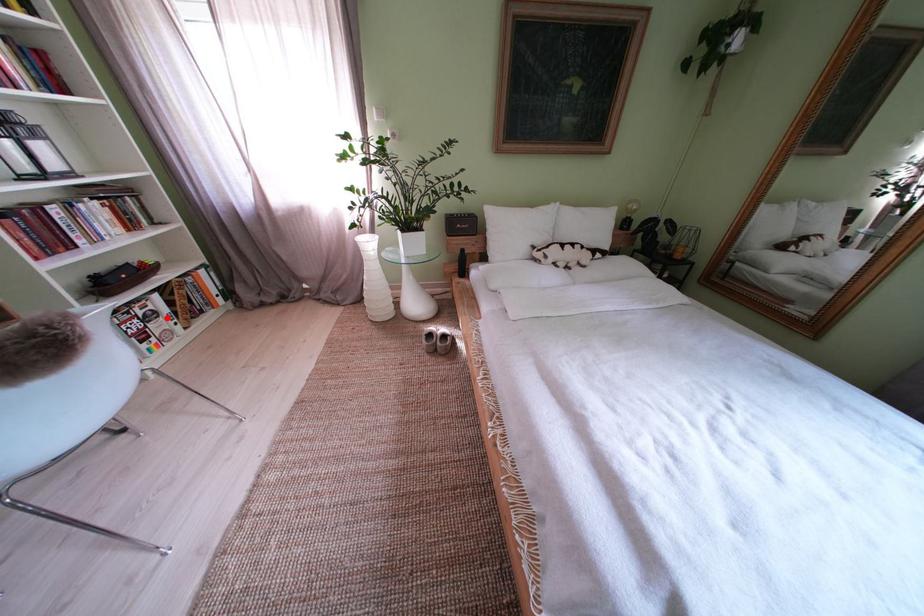
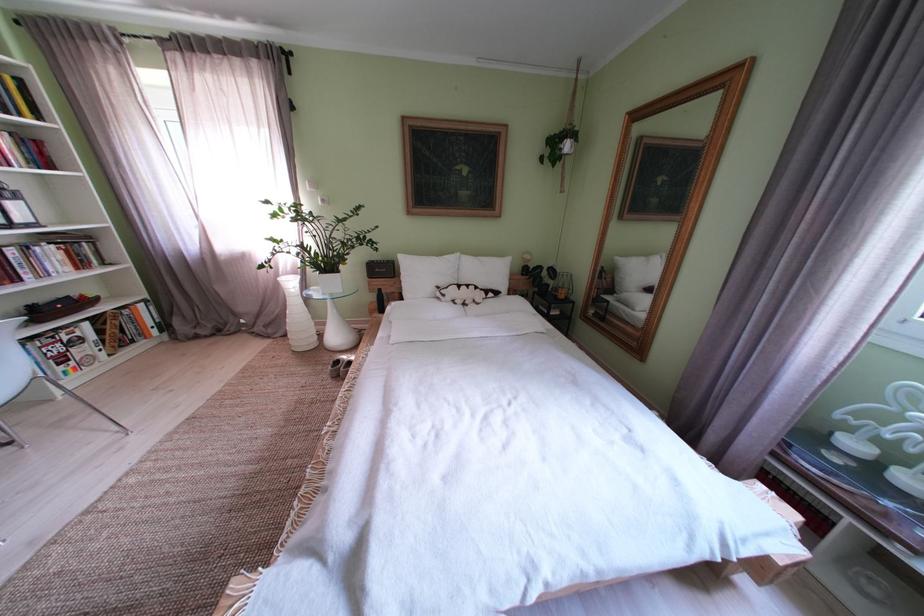
Question: A red point is marked in image1. In image2, is the corresponding 3D point closer to the camera or farther? Reply with the corresponding letter.

Choices:
 (A) The corresponding 3D point is closer.
 (B) The corresponding 3D point is farther.

Answer: (B)